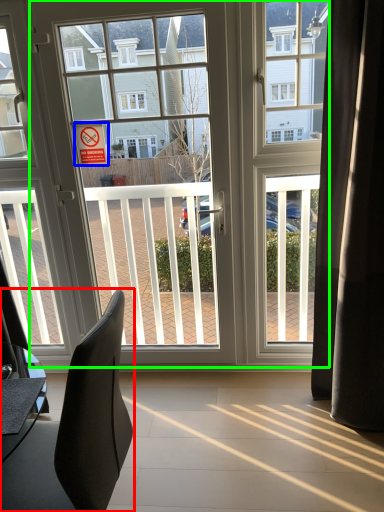
Question: Considering the real-world distances, which object is closest to chair (highlighted by a red box)? parking sign (highlighted by a blue box) or door (highlighted by a green box).

Choices:
 (A) parking sign
 (B) door

Answer: (B)